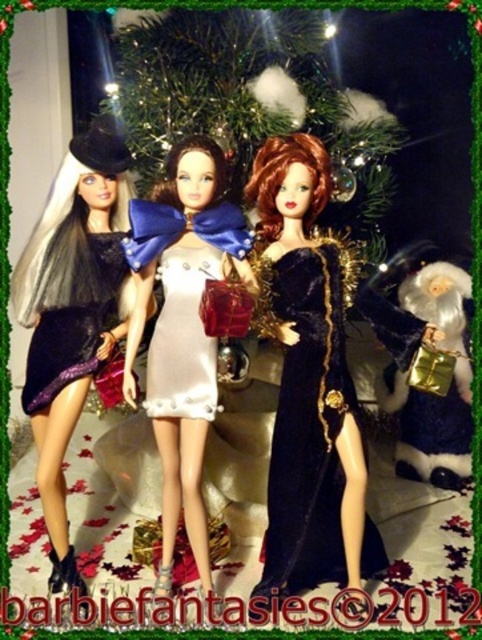
Which of these two, pearlized satin dress at center or shiny purple fabric dress at left, stands shorter?

pearlized satin dress at center is shorter.

Who is more distant from viewer, (182, 250) or (26, 401)?

Positioned behind is point (26, 401).

Between point (200, 410) and point (61, 384), which one is positioned behind?

Point (61, 384)

The height and width of the screenshot is (640, 482). What are the coordinates of `pearlized satin dress at center` in the screenshot? It's located at (183, 339).

Can you confirm if green textured wreath at upper center is smaller than velvet black dress at center?

Incorrect, green textured wreath at upper center is not smaller in size than velvet black dress at center.

Does point (205, 132) lie behind point (286, 358)?

That is True.

Which is in front, point (157, 65) or point (319, 502)?

Point (319, 502) is in front.

Image resolution: width=482 pixels, height=640 pixels. In order to click on green textured wreath at upper center in this screenshot , I will do `click(252, 100)`.

Which of these two, green textured wreath at upper center or pearlized satin dress at center, stands shorter?

With less height is pearlized satin dress at center.

Does green textured wreath at upper center have a lesser height compared to pearlized satin dress at center?

No, green textured wreath at upper center is not shorter than pearlized satin dress at center.

Locate an element on the screen. The height and width of the screenshot is (640, 482). green textured wreath at upper center is located at coordinates (252, 100).

Locate an element on the screen. green textured wreath at upper center is located at coordinates [x=252, y=100].